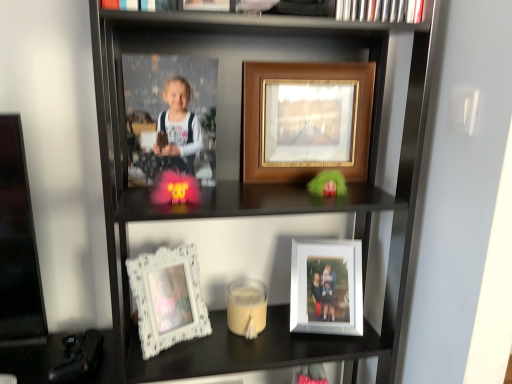
Question: Does white ornate frame at lower left, the 3th picture frame when ordered from right to left, appear on the left side of wooden framed photo at center, the 2th picture frame when ordered from right to left?

Choices:
 (A) no
 (B) yes

Answer: (B)

Question: Is white ornate frame at lower left, the first picture frame in the left-to-right sequence, located outside wooden framed photo at center, placed as the 1th picture frame when sorted from top to bottom?

Choices:
 (A) no
 (B) yes

Answer: (B)

Question: Can you confirm if white ornate frame at lower left, which is the first picture frame from bottom to top, is smaller than wooden framed photo at center, the 2th picture frame when ordered from right to left?

Choices:
 (A) yes
 (B) no

Answer: (A)

Question: Does white ornate frame at lower left, which is the first picture frame from bottom to top, have a greater height compared to wooden framed photo at center, marked as the third picture frame in a bottom-to-top arrangement?

Choices:
 (A) no
 (B) yes

Answer: (A)

Question: Is white ornate frame at lower left, which is the 3th picture frame from top to bottom, bigger than wooden framed photo at center, marked as the second picture frame in a left-to-right arrangement?

Choices:
 (A) yes
 (B) no

Answer: (B)

Question: Considering the positions of matte black book at upper center and white ornate frame at lower left, the first picture frame in the left-to-right sequence, in the image, is matte black book at upper center bigger or smaller than white ornate frame at lower left, the first picture frame in the left-to-right sequence,?

Choices:
 (A) big
 (B) small

Answer: (B)

Question: From the image's perspective, relative to white ornate frame at lower left, which is the 3th picture frame from top to bottom, is matte black book at upper center above or below?

Choices:
 (A) above
 (B) below

Answer: (A)

Question: Is point (369, 13) positioned closer to the camera than point (150, 334)?

Choices:
 (A) farther
 (B) closer

Answer: (B)

Question: In terms of height, does matte black book at upper center look taller or shorter compared to white ornate frame at lower left, the 3th picture frame when ordered from right to left?

Choices:
 (A) short
 (B) tall

Answer: (A)

Question: Considering the positions of wooden framed picture at upper center and white matte candle at center in the image, is wooden framed picture at upper center taller or shorter than white matte candle at center?

Choices:
 (A) short
 (B) tall

Answer: (B)

Question: Is wooden framed picture at upper center bigger or smaller than white matte candle at center?

Choices:
 (A) small
 (B) big

Answer: (B)

Question: Is wooden framed picture at upper center wider or thinner than white matte candle at center?

Choices:
 (A) wide
 (B) thin

Answer: (A)

Question: Is point (160, 44) positioned closer to the camera than point (247, 336)?

Choices:
 (A) closer
 (B) farther

Answer: (A)

Question: Considering the positions of point (330, 125) and point (153, 288), is point (330, 125) closer or farther from the camera than point (153, 288)?

Choices:
 (A) farther
 (B) closer

Answer: (A)

Question: Is wooden framed photo at center, marked as the second picture frame in a left-to-right arrangement, taller or shorter than white ornate frame at lower left, the first picture frame in the left-to-right sequence?

Choices:
 (A) short
 (B) tall

Answer: (B)